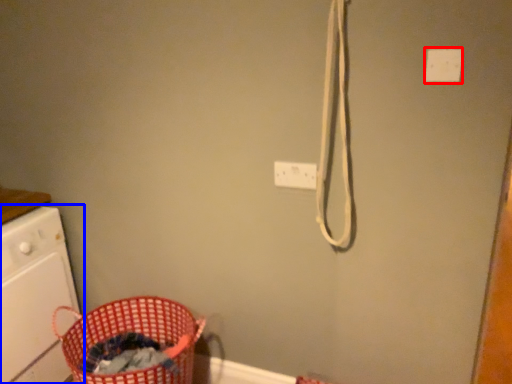
Question: Which point is closer to the camera, light switch (highlighted by a red box) or home appliance (highlighted by a blue box)?

Choices:
 (A) light switch
 (B) home appliance

Answer: (A)